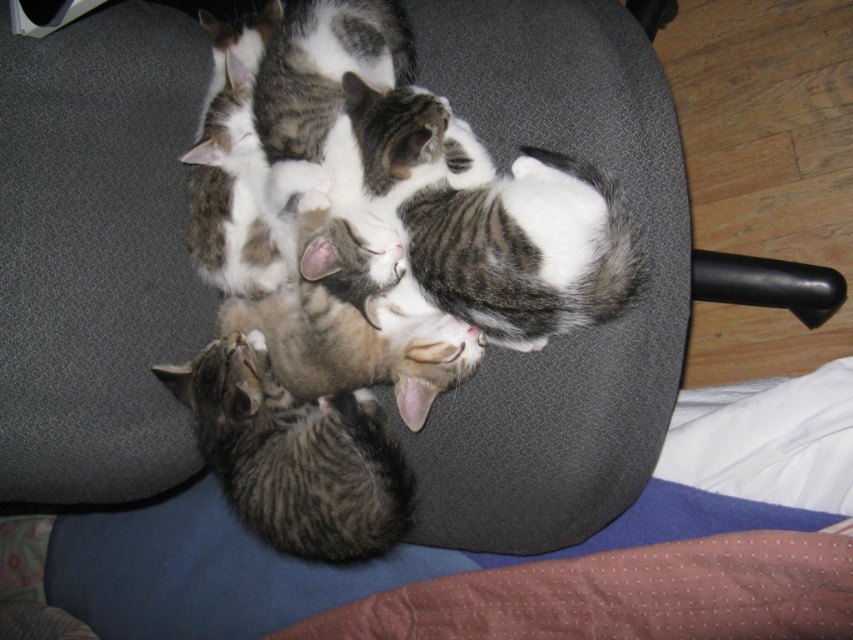
Between tabby fur cat at center and striped fur kitten at center, which one is positioned higher?

tabby fur cat at center is above.

Between point (463, 452) and point (321, 472), which one is positioned in front?

Point (321, 472) is in front.

Where is `tabby fur cat at center`? tabby fur cat at center is located at coordinates click(531, 448).